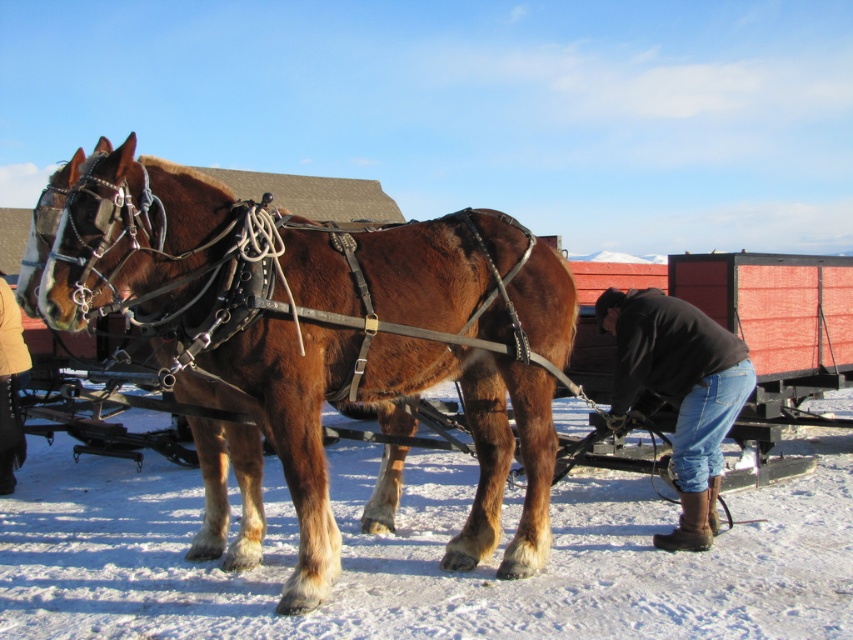
Question: Is black leather boots at lower right positioned before yellow leather boots at lower left?

Choices:
 (A) yes
 (B) no

Answer: (A)

Question: Which object appears farthest from the camera in this image?

Choices:
 (A) brown leather harness at center
 (B) yellow leather boots at lower left

Answer: (B)

Question: Estimate the real-world distances between objects in this image. Which object is farther from the yellow leather boots at lower left?

Choices:
 (A) brown leather harness at center
 (B) black leather boots at lower right

Answer: (B)

Question: Does brown leather harness at center appear on the left side of yellow leather boots at lower left?

Choices:
 (A) yes
 (B) no

Answer: (B)

Question: Which point is closer to the camera?

Choices:
 (A) (41, 288)
 (B) (613, 296)
 (C) (12, 492)

Answer: (A)

Question: Can you confirm if brown leather harness at center is positioned to the right of yellow leather boots at lower left?

Choices:
 (A) yes
 (B) no

Answer: (A)